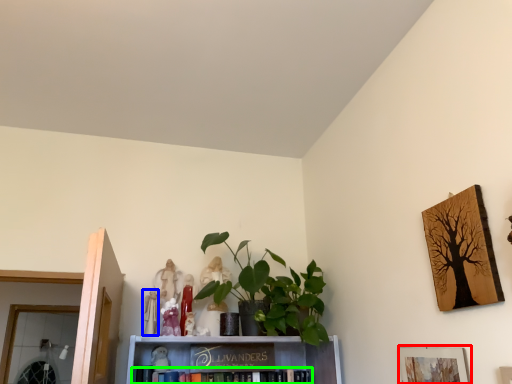
Question: Which object is positioned farthest from picture frame (highlighted by a red box)? Select from toy (highlighted by a blue box) and book (highlighted by a green box).

Choices:
 (A) toy
 (B) book

Answer: (A)